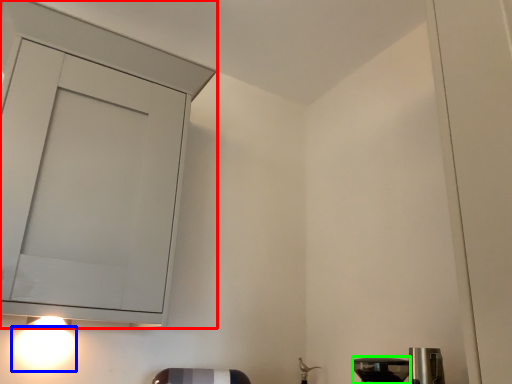
Question: Which object is the farthest from cabinetry (highlighted by a red box)? Choose among these: light (highlighted by a blue box) or appliance (highlighted by a green box).

Choices:
 (A) light
 (B) appliance

Answer: (B)